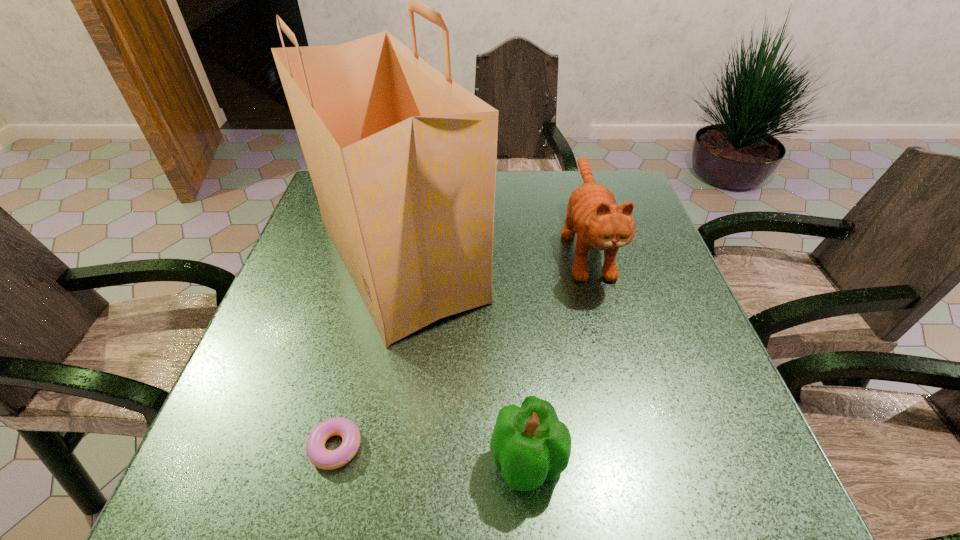
Where is `vacant region that satisfies the following two spatial constraints: 1. on the side of the third tallest object with the superhero design; 2. on the left side of the tallest object`? The height and width of the screenshot is (540, 960). vacant region that satisfies the following two spatial constraints: 1. on the side of the third tallest object with the superhero design; 2. on the left side of the tallest object is located at coordinates (359, 463).

The height and width of the screenshot is (540, 960). I want to click on vacant area that satisfies the following two spatial constraints: 1. on the front side of the bell pepper; 2. on the left side of the doughnut, so click(x=332, y=463).